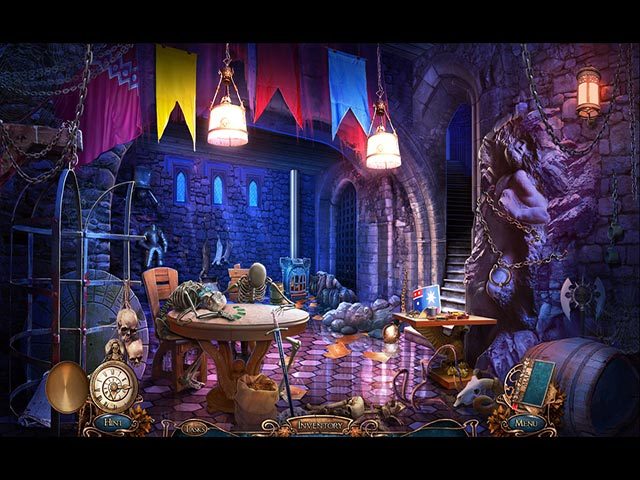
You are a GUI agent. You are given a task and a screenshot of the screen. Output one action in this format:
    pyautogui.click(x=<x>, y=<y>)
    Task: Click on the hands of the clock
    
    Given the screenshot: What is the action you would take?
    pyautogui.click(x=112, y=393), pyautogui.click(x=128, y=387)